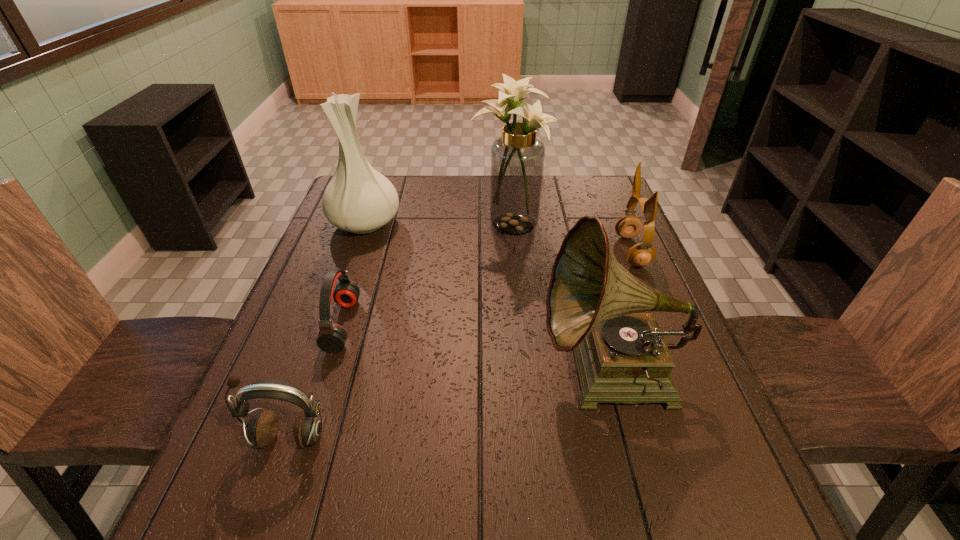
The width and height of the screenshot is (960, 540). In order to click on flower arrangement in this screenshot , I will do `click(517, 158)`.

In order to click on vase in this screenshot , I will do click(358, 199).

The height and width of the screenshot is (540, 960). Find the location of `record player`. record player is located at coordinates (593, 303).

The width and height of the screenshot is (960, 540). Identify the location of the farthest earphone. (629, 226).

The width and height of the screenshot is (960, 540). I want to click on the tallest earphone, so click(x=629, y=226).

The width and height of the screenshot is (960, 540). In order to click on the second shortest earphone in this screenshot , I will do `click(263, 427)`.

Find the location of `the nearest earphone`. the nearest earphone is located at coordinates (263, 427).

I want to click on the shortest earphone, so click(x=332, y=337).

I want to click on the second farthest earphone, so click(332, 337).

At what (x,y) coordinates should I click in order to perform the action: click on vacant space located on the front of the flower arrangement. Please return your answer as a coordinate pair (x, y). Looking at the image, I should click on (515, 287).